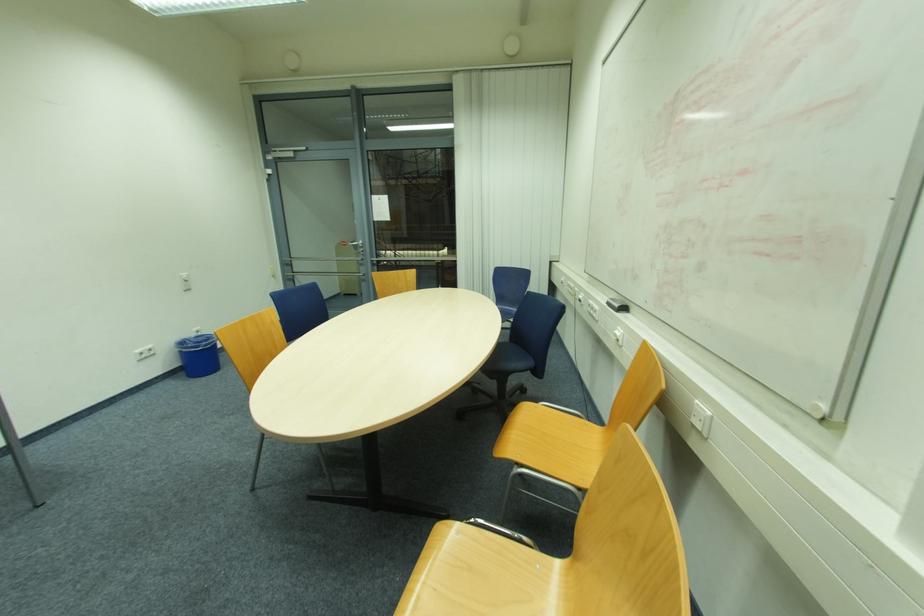
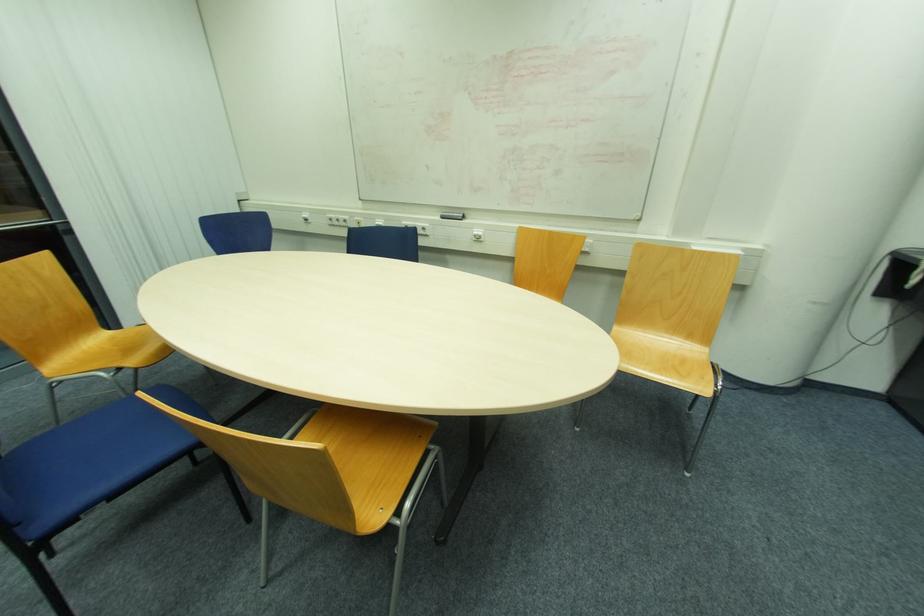
Where in the second image is the point corresponding to the point at 617,331 from the first image?

(477, 233)